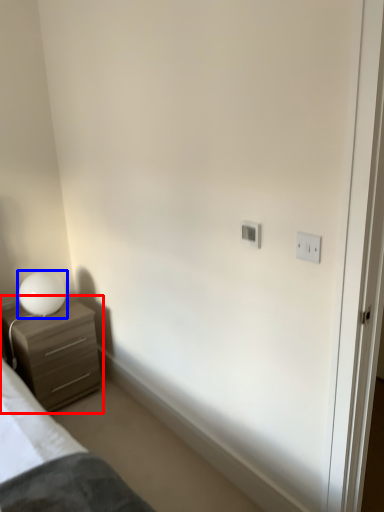
Question: Among these objects, which one is farthest to the camera, chest of drawers (highlighted by a red box) or table lamp (highlighted by a blue box)?

Choices:
 (A) chest of drawers
 (B) table lamp

Answer: (B)